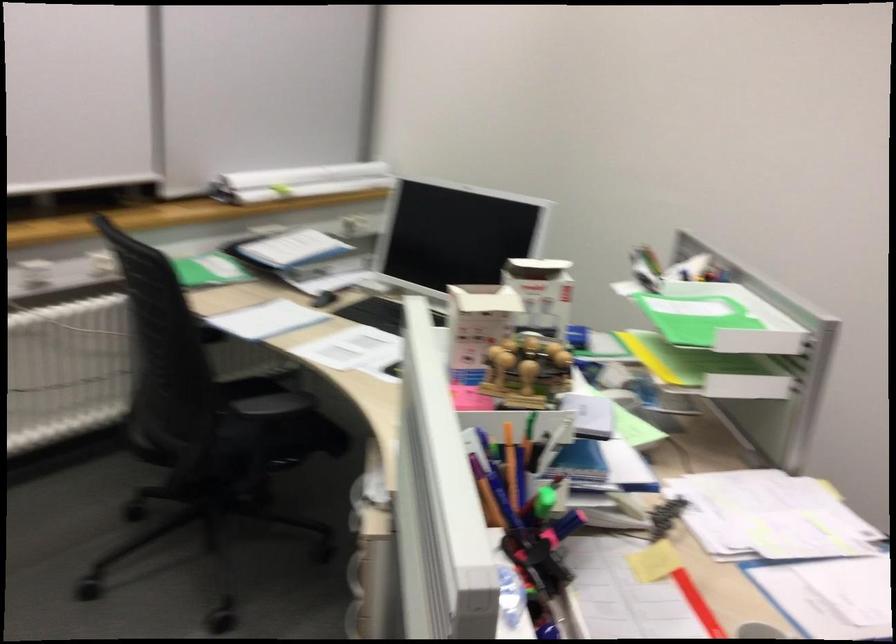
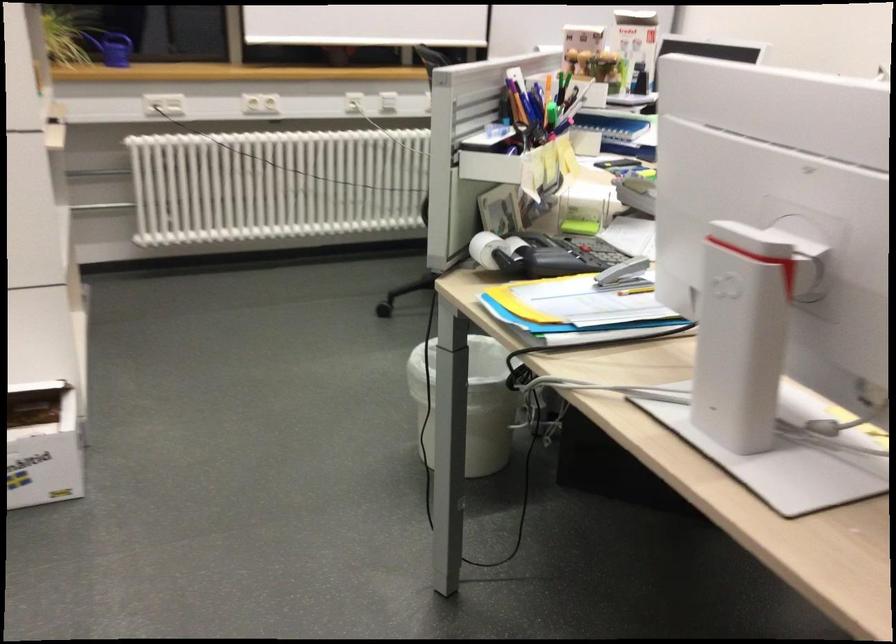
Locate, in the second image, the point that corresponds to (x=485, y=457) in the first image.

(547, 98)